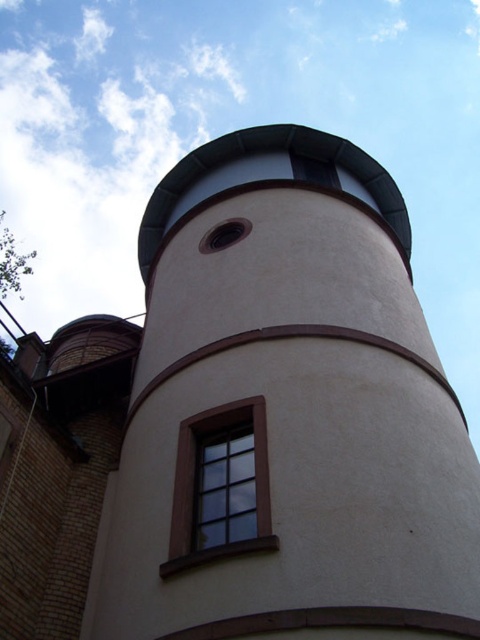
You are standing outside the cylindrical building and want to look through the brown wooden window at center. Which direction should you look relative to the smooth beige tower at center?

You should look downward from the smooth beige tower at center to find the brown wooden window at center, as the smooth beige tower at center is positioned above the brown wooden window at center.

You are an architect planning to install a new light fixture. You need to determine which object, the smooth beige tower at center or the brown wooden window at center, requires a higher mounting height to ensure visibility from the ground. Based on their sizes, which one should you prioritize?

The smooth beige tower at center is much taller than the brown wooden window at center, so you should prioritize installing the light fixture at the height of the smooth beige tower at center to ensure visibility from the ground.

You are an architect designing a new observatory. You have to place a decorative element on the smooth beige tower at center and the brown wooden window at center. Which object should you choose to place the larger decorative element on?

You should place the larger decorative element on the smooth beige tower at center because it has a larger size compared to the brown wooden window at center, allowing for a more prominent display.